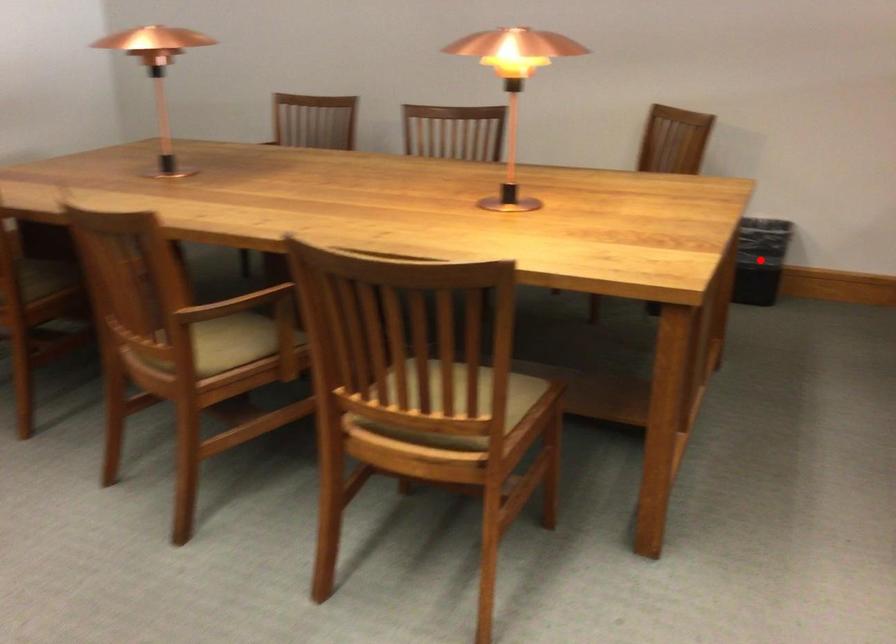
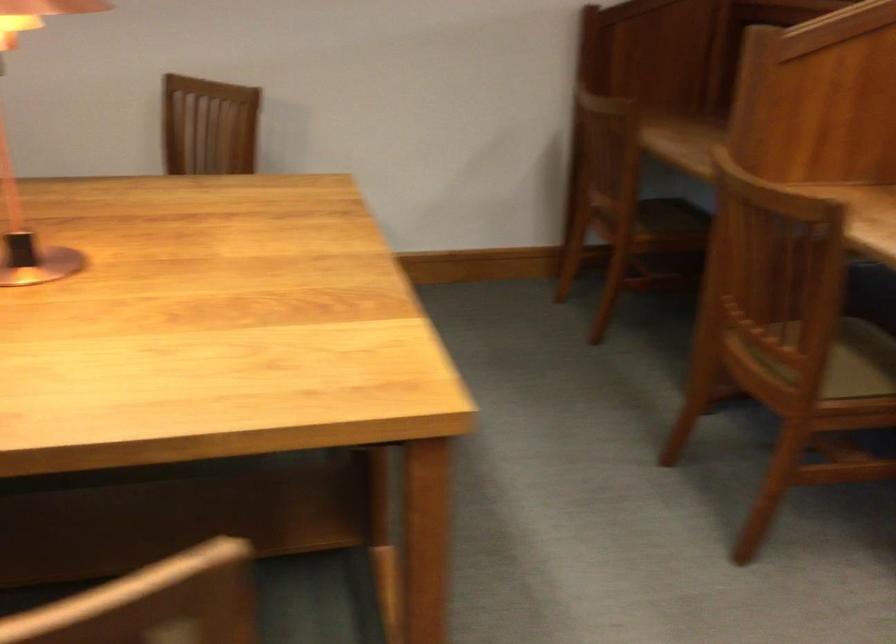
Question: I am providing you with two images of the same scene from different viewpoints. A red point is marked on the first image. At the location where the point appears in image 1, is it still visible in image 2?

Choices:
 (A) Yes
 (B) No

Answer: (B)